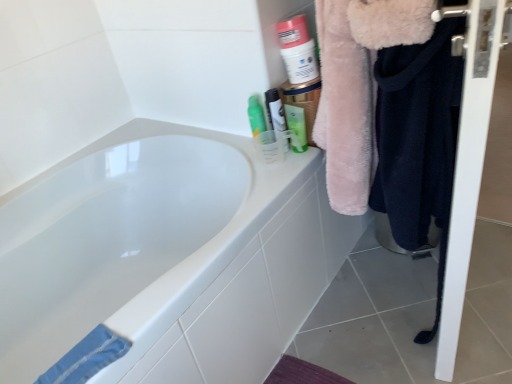
Locate an element on the screen. Image resolution: width=512 pixels, height=384 pixels. vacant space that is in between faded denim towel at lower left and green matte tube at upper right, marked as the 1th mouthwash in a right-to-left arrangement is located at coordinates (214, 240).